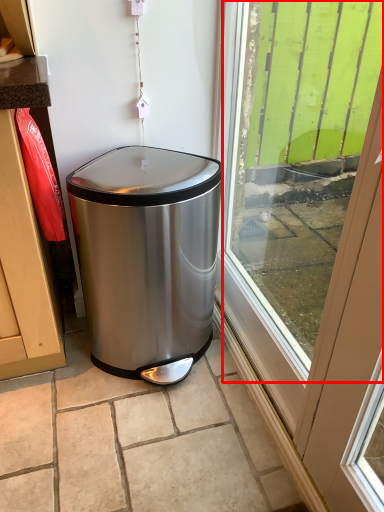
Question: From the image's perspective, what is the correct spatial relationship of window screen (annotated by the red box) in relation to waste container?

Choices:
 (A) above
 (B) below

Answer: (A)